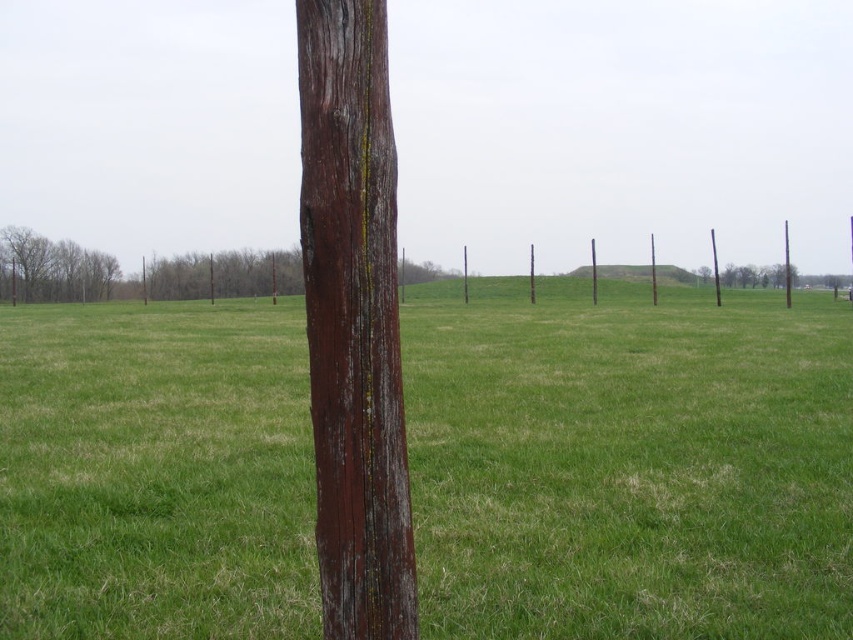
You are standing in the open field and want to place a new flag at the highest point between the smooth brown pole at right and the brown wooden pole at center. Which pole should you choose?

The brown wooden pole at center is higher than the smooth brown pole at right, so you should place the flag at the brown wooden pole at center.

You are standing in the field and want to walk from the smooth brown pole at right to the brown wooden pole at center. In which direction should you move?

You should move to the left because the smooth brown pole at right is to the right of the brown wooden pole at center, so moving left will take you towards it.

You are standing in the middle of the field and see the weathered wood pole at center. If you walk straight towards the point marked at coordinates (352, 321), will you reach the pole?

Yes, the point at coordinates (352, 321) corresponds to the weathered wood pole at center, so walking straight towards it will lead you directly to the pole.